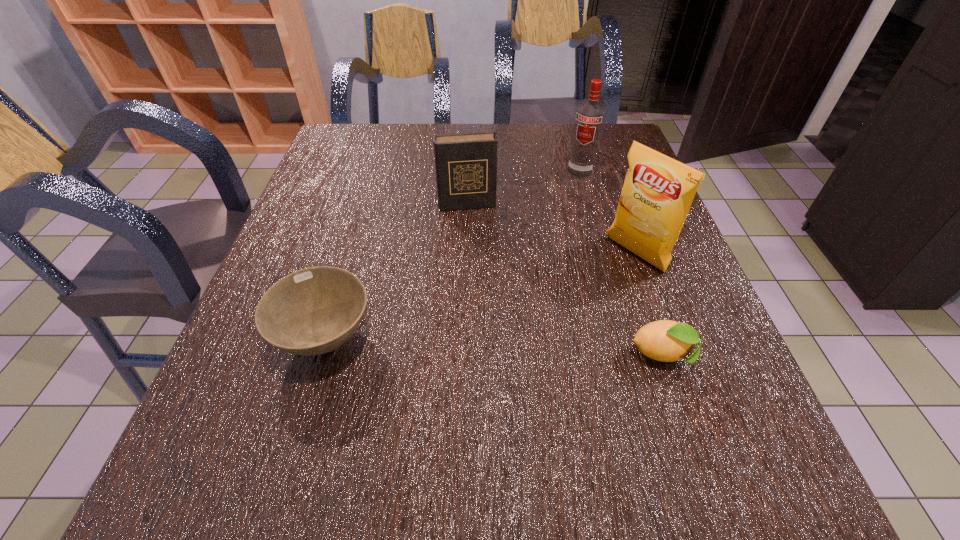
The image size is (960, 540). Identify the location of free space on the desktop that is between the leftmost object and the lemon and is positioned on the front label of the vodka. (500, 347).

The height and width of the screenshot is (540, 960). What are the coordinates of `vacant space on the desktop that is between the leftmost object and the shortest object and is positioned on the front cover of the second farthest object` in the screenshot? It's located at (491, 347).

Image resolution: width=960 pixels, height=540 pixels. I want to click on vacant spot on the desktop that is between the bowl and the shortest object and is positioned on the front of the third nearest object with the logo, so click(x=507, y=347).